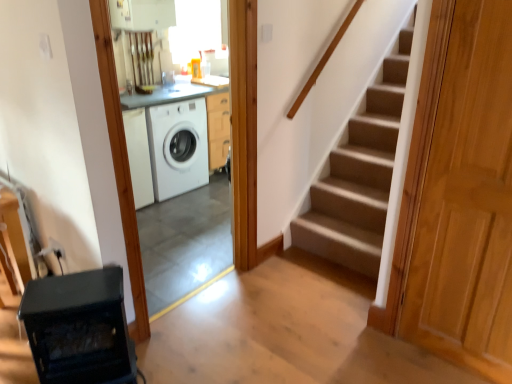
At what (x,y) coordinates should I click in order to perform the action: click on free spot to the right of black glass stove at lower left. Please return your answer as a coordinate pair (x, y). Looking at the image, I should click on (178, 360).